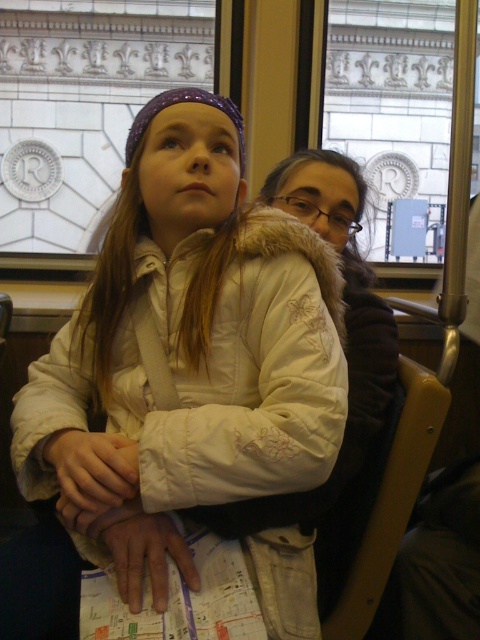
Who is shorter, white fuzzy coat at center or white fur coat at center?

Standing shorter between the two is white fur coat at center.

Looking at this image, between white fuzzy coat at center and white fur coat at center, which one appears on the left side from the viewer's perspective?

Positioned to the left is white fuzzy coat at center.

You are a GUI agent. You are given a task and a screenshot of the screen. Output one action in this format:
    pyautogui.click(x=<x>, y=<y>)
    Task: Click on the white fuzzy coat at center
    This screenshot has height=640, width=480.
    Given the screenshot: What is the action you would take?
    pyautogui.click(x=178, y=358)

You are a GUI agent. You are given a task and a screenshot of the screen. Output one action in this format:
    pyautogui.click(x=<x>, y=<y>)
    Task: Click on the white fuzzy coat at center
    This screenshot has height=640, width=480.
    Given the screenshot: What is the action you would take?
    pyautogui.click(x=178, y=358)